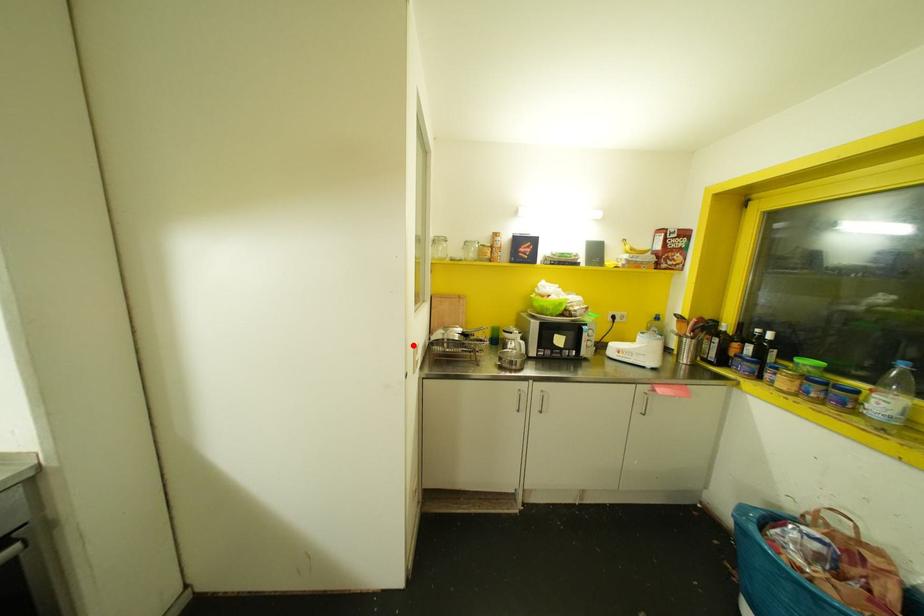
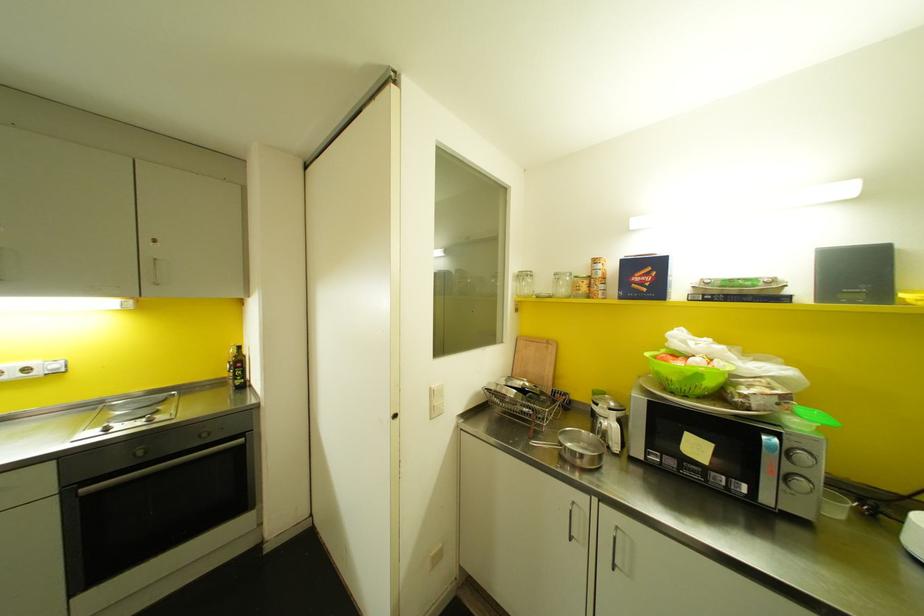
The point at the highlighted location is marked in the first image. Where is the corresponding point in the second image?

(430, 387)